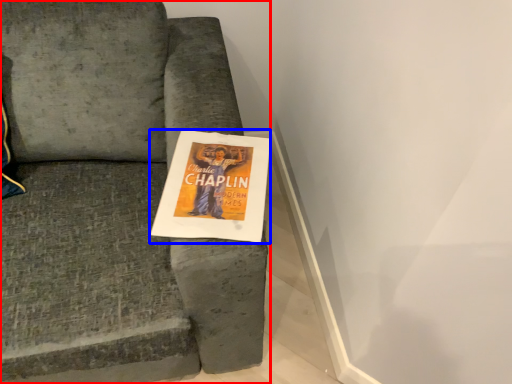
Question: Which point is further to the camera, chair (highlighted by a red box) or flyer (highlighted by a blue box)?

Choices:
 (A) chair
 (B) flyer

Answer: (B)